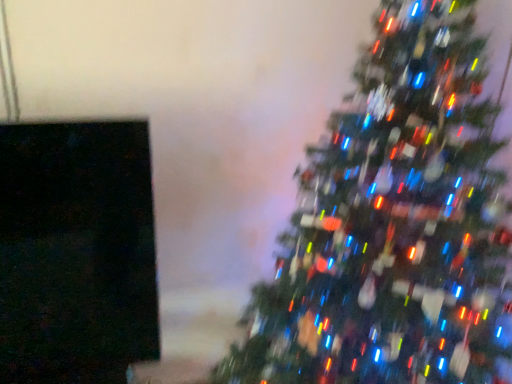
Locate an element on the screen. green matte christmas tree at right is located at coordinates (393, 223).

The width and height of the screenshot is (512, 384). What do you see at coordinates (393, 223) in the screenshot?
I see `green matte christmas tree at right` at bounding box center [393, 223].

Where is `green matte christmas tree at right`? green matte christmas tree at right is located at coordinates point(393,223).